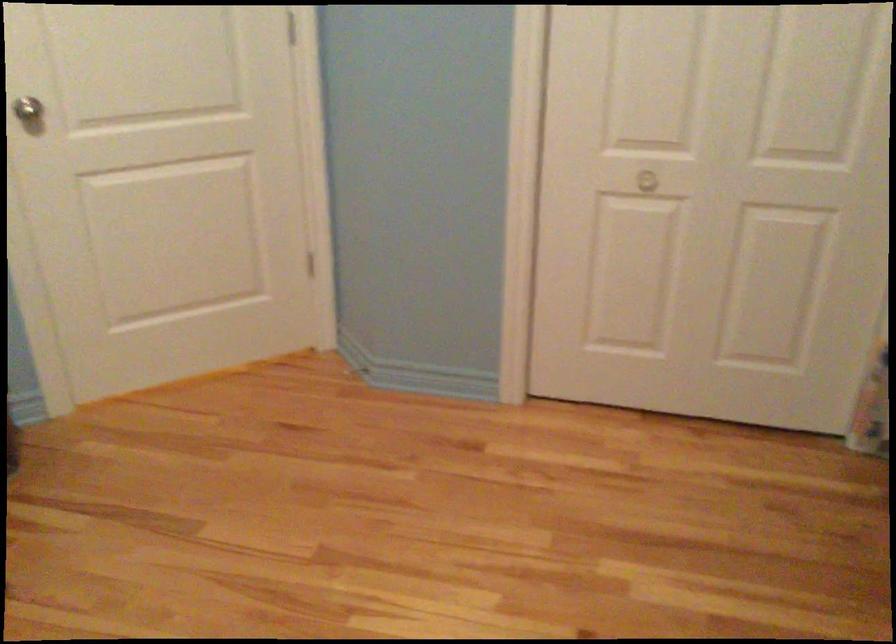
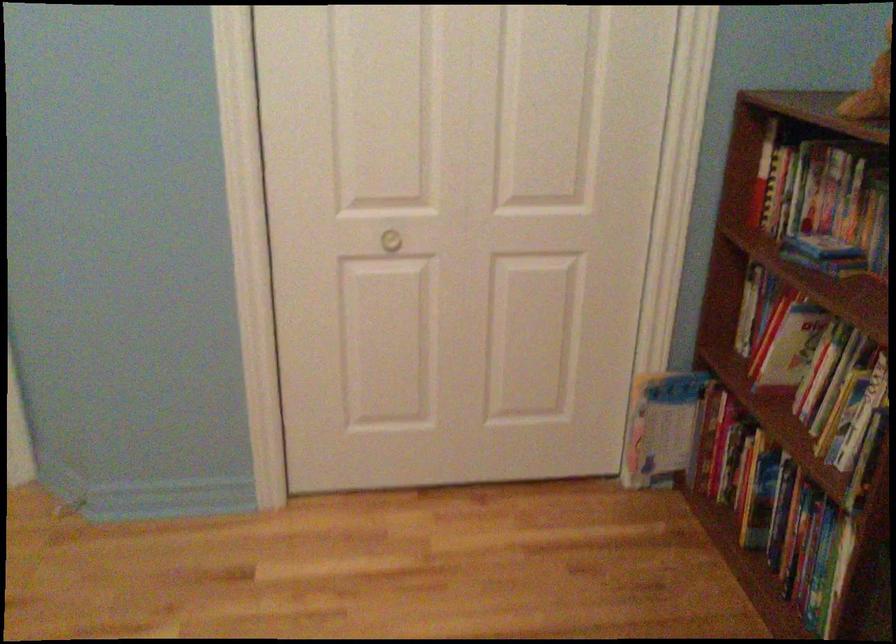
Question: The camera is either moving clockwise (left) or counter-clockwise (right) around the object. The first image is from the beginning of the video and the second image is from the end. Is the camera moving left or right when shooting the video?

Choices:
 (A) Left
 (B) Right

Answer: (A)